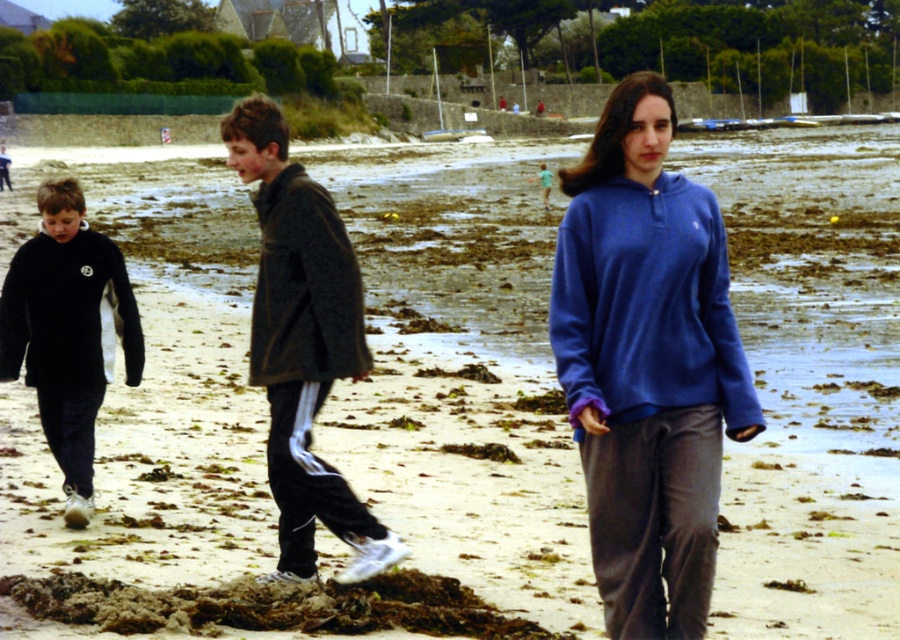
Question: Does black fleece jacket at left have a greater width compared to black fleece sweatshirt at left?

Choices:
 (A) no
 (B) yes

Answer: (A)

Question: Which object is closer to the camera taking this photo?

Choices:
 (A) blue fleece at center
 (B) black fleece jacket at left
 (C) brown/muddy sand at lower left
 (D) dark gray fleece jacket at center

Answer: (A)

Question: Which point appears closest to the camera in this image?

Choices:
 (A) (86, 593)
 (B) (689, 333)
 (C) (329, 369)
 (D) (614, 378)

Answer: (D)

Question: Can you confirm if blue fleece sweatshirt at center is positioned below brown/muddy sand at lower left?

Choices:
 (A) no
 (B) yes

Answer: (A)

Question: Which object is closer to the camera taking this photo?

Choices:
 (A) blue fleece at center
 (B) dark gray fleece sweatshirt at center
 (C) black fleece sweatshirt at left

Answer: (A)

Question: Can you confirm if black fleece jacket at left is bigger than brown/muddy sand at lower left?

Choices:
 (A) no
 (B) yes

Answer: (B)